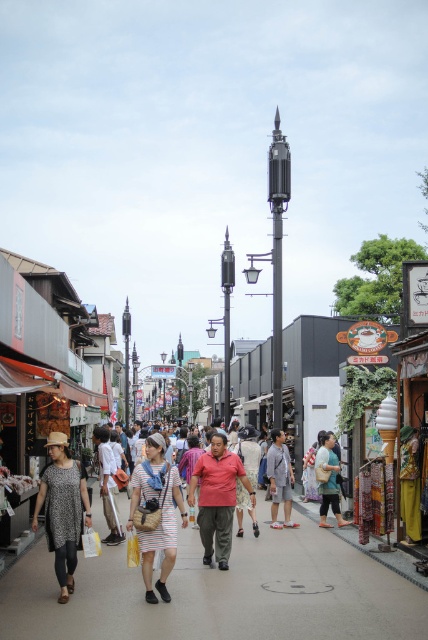
Does point (83, 628) come in front of point (151, 506)?

That is True.

Is gray concrete pavement at center to the right of striped fabric dress at center from the viewer's perspective?

Correct, you'll find gray concrete pavement at center to the right of striped fabric dress at center.

Who is more distant from viewer, (x=85, y=564) or (x=157, y=467)?

Point (x=85, y=564)

The height and width of the screenshot is (640, 428). What are the coordinates of `gray concrete pavement at center` in the screenshot? It's located at (220, 593).

Is point (139, 531) closer to camera compared to point (59, 452)?

Yes, point (139, 531) is in front of point (59, 452).

Describe the element at coordinates (158, 515) in the screenshot. I see `striped fabric dress at center` at that location.

The width and height of the screenshot is (428, 640). I want to click on striped fabric dress at center, so click(158, 515).

Is striped fabric dress at center closer to the viewer compared to green fabric bag at center?

Yes, it is in front of green fabric bag at center.

Between striped fabric dress at center and green fabric bag at center, which one is positioned lower?

Positioned lower is green fabric bag at center.

The height and width of the screenshot is (640, 428). In order to click on striped fabric dress at center in this screenshot , I will do `click(158, 515)`.

Locate an element on the screen. Image resolution: width=428 pixels, height=640 pixels. striped fabric dress at center is located at coordinates (158, 515).